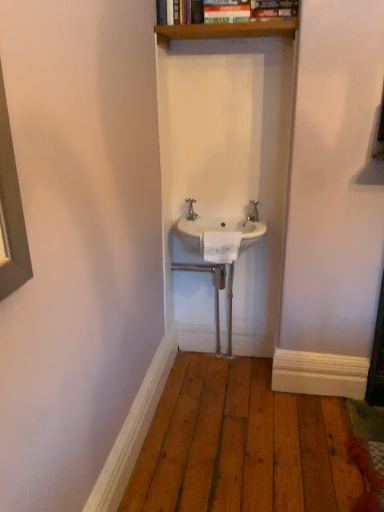
Image resolution: width=384 pixels, height=512 pixels. I want to click on free space in front of silver metallic tap at center, so click(x=203, y=223).